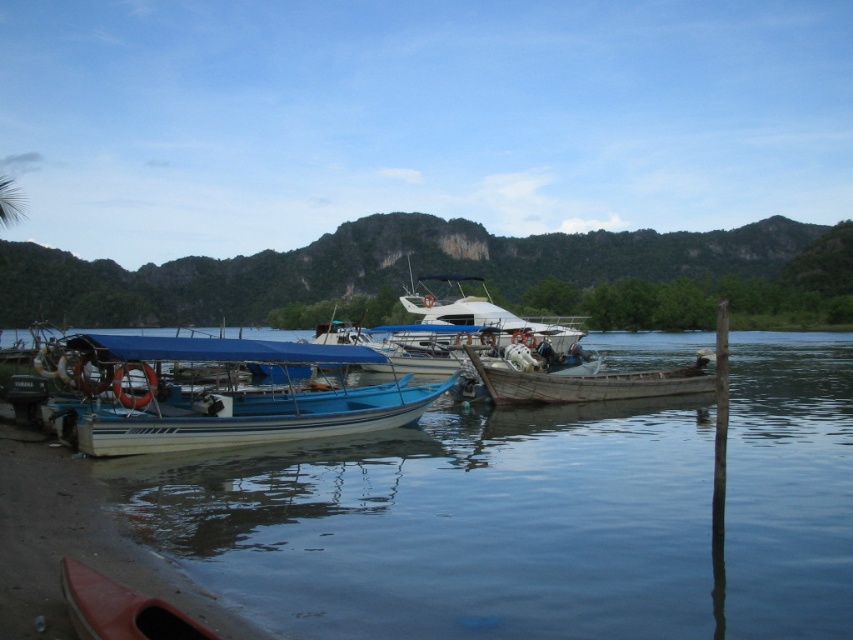
You are standing on the dock and want to board the blue matte boat at center. Given that the dock extends from point A at coordinates 0.5 to 0.8 along the x and y axes, can you reach the boat directly from your current position?

The blue matte boat at center is located at point (215, 396). Since the dock extends from 0.5 to 0.8 in both axes, the boat is within the docked area, so you can reach it directly.